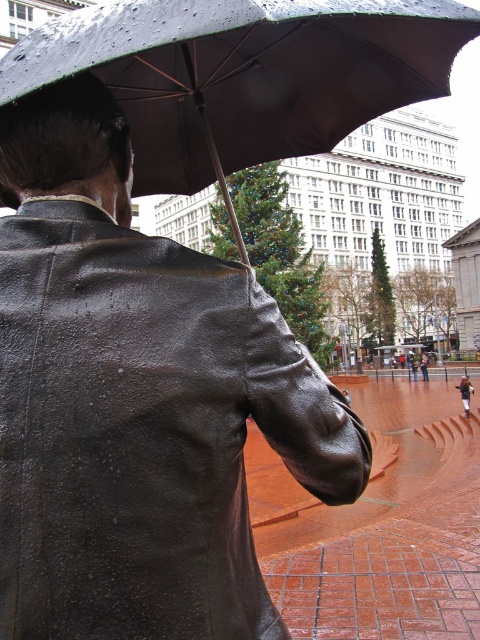
Looking at this image, you are standing in the plaza and want to take a photo of both the statue and the Christmas tree. You notice two points in the image labeled as point (384,17) and point (459,384). Which point should you focus on to ensure both the statue and the Christmas tree are in sharp focus?

You should focus on point (384,17) because it is closer to the camera than point (459,384), ensuring that both the statue and the Christmas tree will be in focus when using the hyperfocal distance technique.

You are standing in the plaza and want to take a photo of the shiny black umbrella at upper center and the brown leather jacket at center. Which object should you focus on first if you want to capture both in a single frame without moving your camera?

You should focus on the shiny black umbrella at upper center first because it is much taller than the brown leather jacket at center, so adjusting the focus to the taller object ensures both are in the frame.